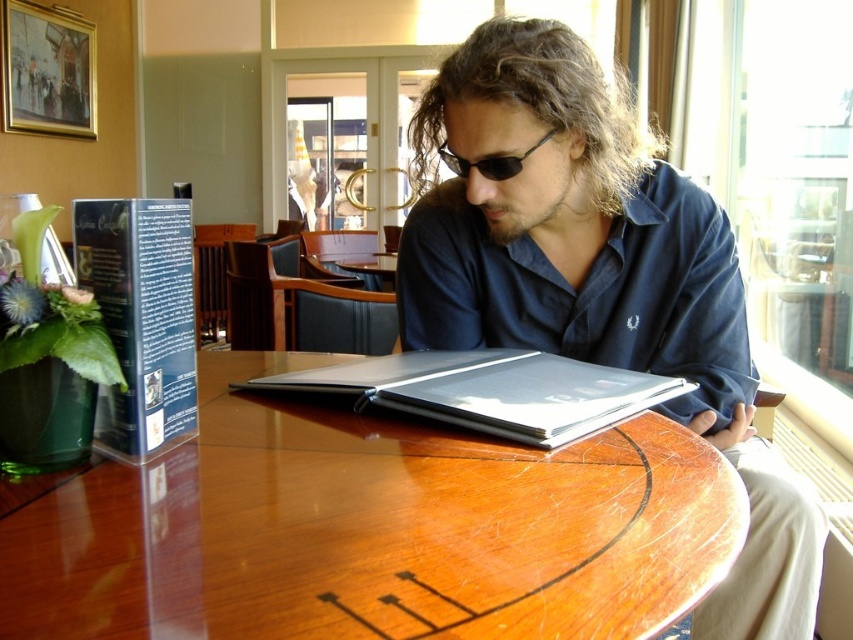
Question: Among these objects, which one is nearest to the camera?

Choices:
 (A) silver metallic book at center
 (B) shiny wood table at center

Answer: (B)

Question: Does silver metallic book at center have a smaller size compared to sunglasses at center?

Choices:
 (A) yes
 (B) no

Answer: (B)

Question: Which of the following is the closest to the observer?

Choices:
 (A) (165, 426)
 (B) (440, 144)
 (C) (482, 376)
 (D) (173, 540)

Answer: (D)

Question: Which point is farther to the camera?

Choices:
 (A) (467, 166)
 (B) (534, 428)
 (C) (106, 522)
 (D) (744, 396)

Answer: (D)

Question: Does blue hardcover book at left have a smaller size compared to silver metallic book at center?

Choices:
 (A) yes
 (B) no

Answer: (A)

Question: Is shiny wood table at center in front of silver metallic book at center?

Choices:
 (A) yes
 (B) no

Answer: (A)